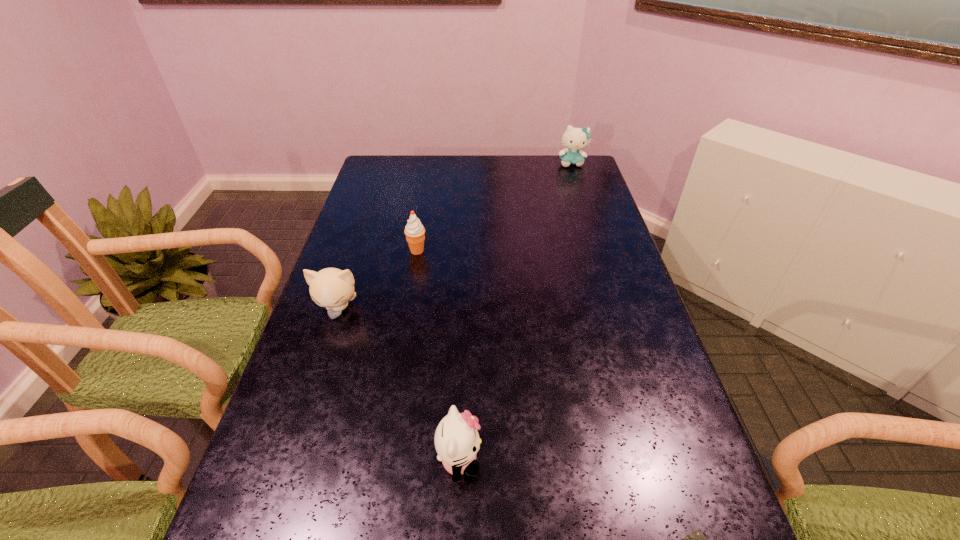
Find the location of `vacant space located 0.270m on the face of the second farthest kitten`. vacant space located 0.270m on the face of the second farthest kitten is located at coordinates (301, 418).

You are a GUI agent. You are given a task and a screenshot of the screen. Output one action in this format:
    pyautogui.click(x=<x>, y=<y>)
    Task: Click on the vacant area situated 0.200m on the front-facing side of the second kitten from left to right
    
    Given the screenshot: What is the action you would take?
    pyautogui.click(x=584, y=461)

Where is `object situated at the far edge`? The image size is (960, 540). object situated at the far edge is located at coordinates (574, 139).

Find the location of `object situated at the left edge`. object situated at the left edge is located at coordinates (332, 288).

At what (x,y) coordinates should I click in order to perform the action: click on object at the right edge. Please return your answer as a coordinate pair (x, y). The image size is (960, 540). Looking at the image, I should click on (574, 139).

Where is `object that is at the far right corner`? object that is at the far right corner is located at coordinates (574, 139).

The image size is (960, 540). Find the location of `free point at the far edge`. free point at the far edge is located at coordinates (456, 159).

Where is `vacant space at the left edge`? The width and height of the screenshot is (960, 540). vacant space at the left edge is located at coordinates (348, 325).

Where is `free region at the right edge`? free region at the right edge is located at coordinates (585, 186).

The height and width of the screenshot is (540, 960). In the image, there is a desktop. Find the location of `blank space at the far left corner`. blank space at the far left corner is located at coordinates (402, 157).